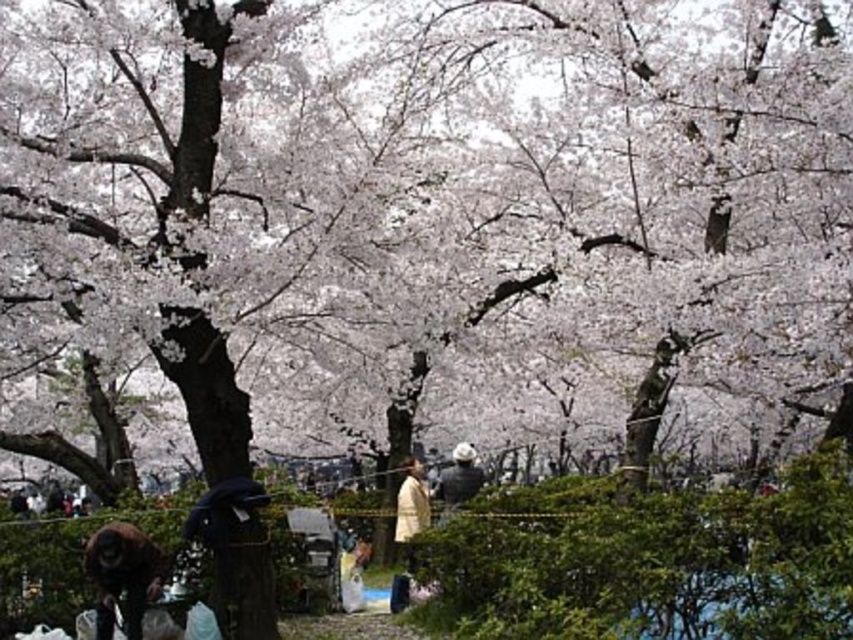
Question: Which is farther from the light beige fabric coat at center?

Choices:
 (A) white matte jacket at center
 (B) brown fur monkey at lower left

Answer: (B)

Question: Is brown fur monkey at lower left further to the viewer compared to light beige fabric coat at center?

Choices:
 (A) yes
 (B) no

Answer: (B)

Question: Observing the image, what is the correct spatial positioning of brown fur monkey at lower left in reference to light beige fabric coat at center?

Choices:
 (A) left
 (B) right

Answer: (A)

Question: Which point appears closest to the camera in this image?

Choices:
 (A) [410, 490]
 (B) [143, 602]
 (C) [445, 476]

Answer: (B)

Question: Does light beige fabric coat at center come behind white matte jacket at center?

Choices:
 (A) no
 (B) yes

Answer: (A)

Question: Among these points, which one is farthest from the camera?

Choices:
 (A) (463, 486)
 (B) (108, 605)

Answer: (A)